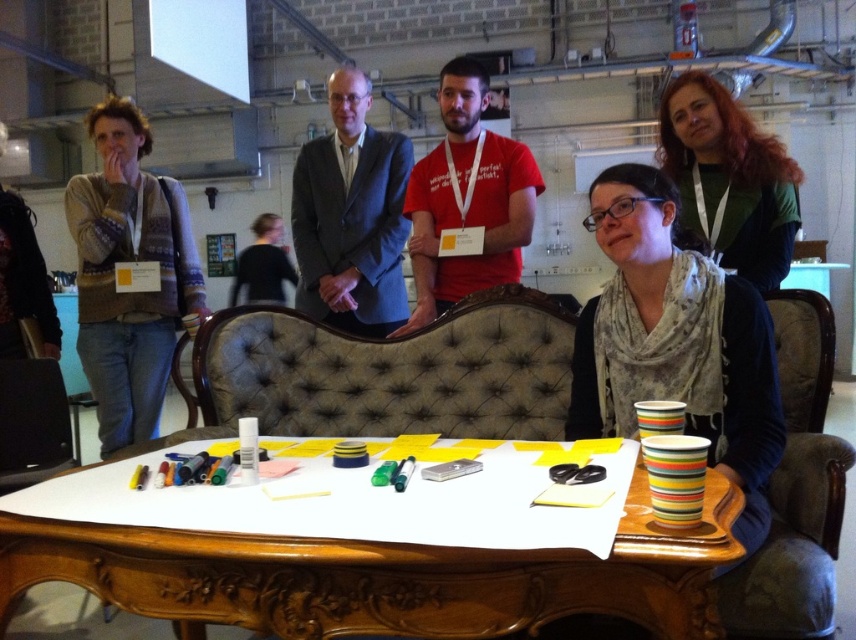
Does knitted sweater at left have a lesser width compared to matte red t-shirt at center?

In fact, knitted sweater at left might be wider than matte red t-shirt at center.

Can you confirm if knitted sweater at left is smaller than matte red t-shirt at center?

No, knitted sweater at left is not smaller than matte red t-shirt at center.

Between point (68, 180) and point (468, 262), which one is positioned behind?

The point (68, 180) is behind.

Find the location of a particular element. knitted sweater at left is located at coordinates (125, 260).

Is point (727, 627) more distant than point (361, 212)?

No, it is not.

Is brown fabric chair at center further to the viewer compared to matte black suit at center?

No, it is not.

Between point (764, 628) and point (346, 289), which one is positioned in front?

Point (764, 628) is in front.

At what (x,y) coordinates should I click in order to perform the action: click on brown fabric chair at center. Please return your answer as a coordinate pair (x, y). The width and height of the screenshot is (856, 640). Looking at the image, I should click on (795, 490).

Who is positioned more to the left, knitted sweater at left or brown fabric chair at center?

knitted sweater at left is more to the left.

Identify the location of knitted sweater at left. Image resolution: width=856 pixels, height=640 pixels. (125, 260).